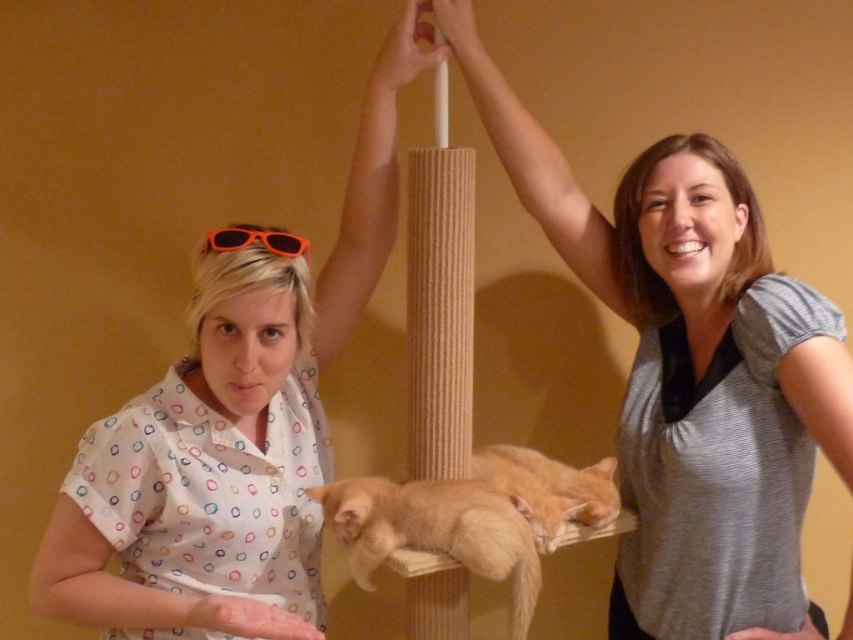
Question: Which object is positioned closest to the orange fur cat at center?

Choices:
 (A) orange plastic sunglasses at upper center
 (B) white dotted shirt at upper left
 (C) gray matte shirt at center

Answer: (B)

Question: Estimate the real-world distances between objects in this image. Which object is closer to the white dotted shirt at upper left?

Choices:
 (A) gray matte shirt at center
 (B) orange fur cat at center

Answer: (B)

Question: Is gray matte shirt at center thinner than orange plastic sunglasses at upper center?

Choices:
 (A) no
 (B) yes

Answer: (A)

Question: Which object is closer to the camera taking this photo?

Choices:
 (A) orange fur cat at center
 (B) white dotted shirt at upper left
 (C) orange plastic sunglasses at upper center
 (D) gray matte shirt at center

Answer: (B)

Question: Is white dotted shirt at upper left thinner than gray matte shirt at center?

Choices:
 (A) no
 (B) yes

Answer: (B)

Question: Does gray matte shirt at center have a larger size compared to orange plastic sunglasses at upper center?

Choices:
 (A) no
 (B) yes

Answer: (B)